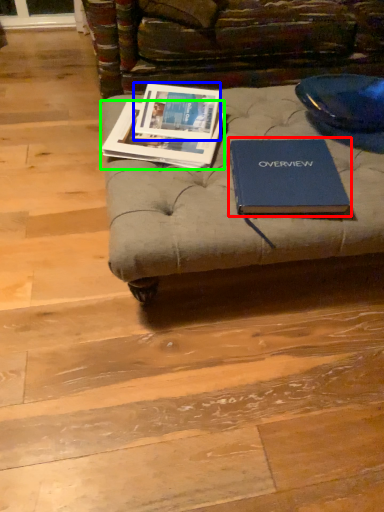
Question: Which object is positioned farthest from book (highlighted by a red box)? Select from book cover (highlighted by a blue box) and book (highlighted by a green box).

Choices:
 (A) book cover
 (B) book

Answer: (A)